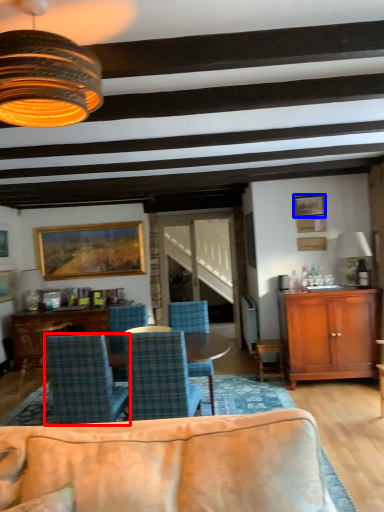
Question: Which object is closer to the camera taking this photo, chair (highlighted by a red box) or picture frame (highlighted by a blue box)?

Choices:
 (A) chair
 (B) picture frame

Answer: (A)